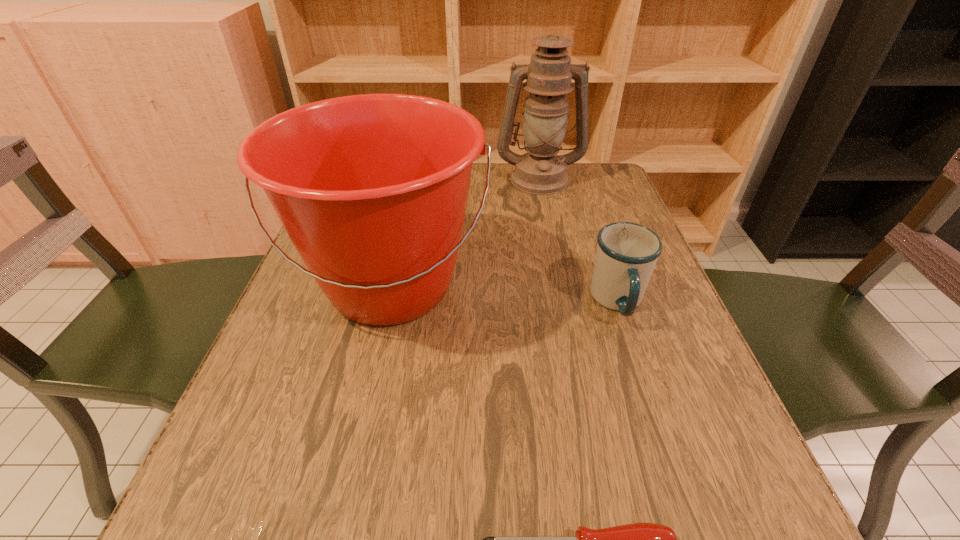
Find the location of a particular element. Image resolution: width=960 pixels, height=540 pixels. object situated at the far right corner is located at coordinates (540, 171).

The height and width of the screenshot is (540, 960). In order to click on vacant space at the far edge of the desktop in this screenshot , I will do `click(491, 185)`.

Identify the location of vacant region at the near edge of the desktop. This screenshot has width=960, height=540. (399, 537).

Where is `vacant space at the left edge of the desktop`? This screenshot has height=540, width=960. vacant space at the left edge of the desktop is located at coordinates (285, 474).

Find the location of a particular element. Image resolution: width=960 pixels, height=540 pixels. vacant space at the right edge of the desktop is located at coordinates (605, 338).

Where is `vacant space at the far right corner of the desktop`? vacant space at the far right corner of the desktop is located at coordinates (603, 167).

Identify the location of vacant area that lies between the oil lamp and the second shortest object. (579, 240).

Locate an element on the screen. The image size is (960, 540). vacant area that lies between the oil lamp and the bucket is located at coordinates (466, 232).

At what (x,y) coordinates should I click in order to perform the action: click on vacant area between the bucket and the mug. Please return your answer as a coordinate pair (x, y). Image resolution: width=960 pixels, height=540 pixels. Looking at the image, I should click on click(x=505, y=294).

What are the coordinates of `vacant region between the third tallest object and the bucket` in the screenshot? It's located at (505, 294).